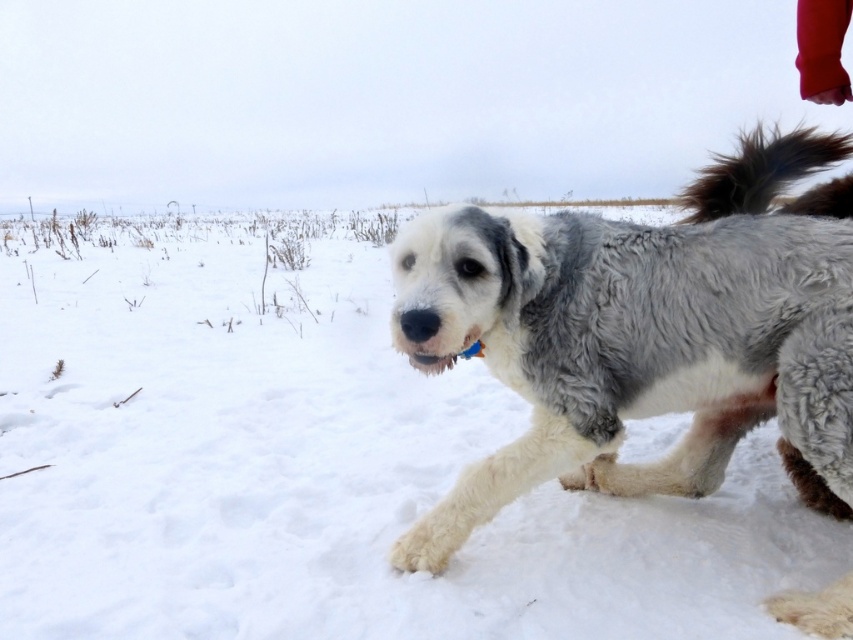
Looking at this image, which of these two, white fluffy snow at center or brown fluffy tail at upper right, stands shorter?

brown fluffy tail at upper right

Does white fluffy snow at center appear under brown fluffy tail at upper right?

Yes.

Is point (392, 525) positioned before point (703, 205)?

Yes, point (392, 525) is in front of point (703, 205).

Where is `white fluffy snow at center`? white fluffy snow at center is located at coordinates (322, 472).

Can you confirm if white fluffy snow at center is positioned below fuzzy gray dog at center?

No, white fluffy snow at center is not below fuzzy gray dog at center.

Which of these two, white fluffy snow at center or fuzzy gray dog at center, stands taller?

With more height is white fluffy snow at center.

Is point (111, 404) positioned after point (418, 292)?

Yes, point (111, 404) is farther from viewer.

Find the location of a particular element. This screenshot has height=640, width=853. white fluffy snow at center is located at coordinates (322, 472).

In the scene shown: Can you confirm if fuzzy gray dog at center is positioned to the right of brown fluffy tail at upper right?

Incorrect, fuzzy gray dog at center is not on the right side of brown fluffy tail at upper right.

Measure the distance between fuzzy gray dog at center and camera.

A distance of 2.08 meters exists between fuzzy gray dog at center and camera.

This screenshot has height=640, width=853. Identify the location of fuzzy gray dog at center. pos(641,336).